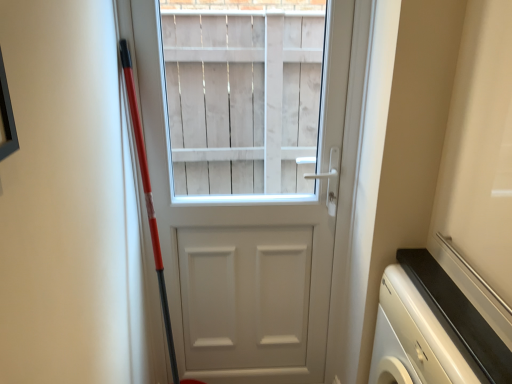
What do you see at coordinates (415, 337) in the screenshot?
I see `white glossy dishwasher at lower right` at bounding box center [415, 337].

From the picture: Measure the distance between point (381, 302) and camera.

Point (381, 302) and camera are 4.66 feet apart from each other.

You are a GUI agent. You are given a task and a screenshot of the screen. Output one action in this format:
    pyautogui.click(x=<x>, y=<y>)
    Task: Click on the white glossy dishwasher at lower right
    This screenshot has width=512, height=384.
    Given the screenshot: What is the action you would take?
    (415, 337)

Describe the element at coordinates (251, 180) in the screenshot. The height and width of the screenshot is (384, 512). I see `white matte door at center` at that location.

In order to click on white matte door at center in this screenshot , I will do `click(251, 180)`.

What is the approximate height of white matte door at center?

white matte door at center is 5.37 feet tall.

This screenshot has width=512, height=384. I want to click on white glossy dishwasher at lower right, so click(415, 337).

Consider the image. Considering the positions of objects white glossy dishwasher at lower right and white matte door at center in the image provided, who is more to the right, white glossy dishwasher at lower right or white matte door at center?

Positioned to the right is white glossy dishwasher at lower right.

Considering the positions of objects white glossy dishwasher at lower right and white matte door at center in the image provided, who is in front, white glossy dishwasher at lower right or white matte door at center?

white glossy dishwasher at lower right.

Considering the positions of points (399, 336) and (310, 173), is point (399, 336) farther from camera compared to point (310, 173)?

No, (399, 336) is in front of (310, 173).

From the image's perspective, is white glossy dishwasher at lower right above or below white matte door at center?

Clearly, from the image's perspective, white glossy dishwasher at lower right is below white matte door at center.

From a real-world perspective, between white glossy dishwasher at lower right and white matte door at center, who is vertically lower?

In real-world perspective, white glossy dishwasher at lower right is lower.

Which of these two, white glossy dishwasher at lower right or white matte door at center, is wider?

white glossy dishwasher at lower right.

Based on the photo, can you confirm if white glossy dishwasher at lower right is taller than white matte door at center?

No, white glossy dishwasher at lower right is not taller than white matte door at center.

From the picture: Is white glossy dishwasher at lower right smaller than white matte door at center?

No, white glossy dishwasher at lower right is not smaller than white matte door at center.

Looking at this image, does white glossy dishwasher at lower right contain white matte door at center?

No.

Would you consider white glossy dishwasher at lower right to be distant from white matte door at center?

They are positioned close to each other.

Is white glossy dishwasher at lower right positioned with its back to white matte door at center?

No, white glossy dishwasher at lower right is not facing the opposite direction of white matte door at center.

In the image, there is a white matte door at center. Find the location of `dish washer below it (from the image's perspective)`. dish washer below it (from the image's perspective) is located at coordinates (415, 337).

Does white matte door at center appear on the left side of white glossy dishwasher at lower right?

Yes.

Who is more distant, white matte door at center or white glossy dishwasher at lower right?

white matte door at center is further away from the camera.

Considering the positions of points (212, 168) and (413, 340), is point (212, 168) farther from camera compared to point (413, 340)?

That is True.

From the image's perspective, is white matte door at center positioned above or below white glossy dishwasher at lower right?

white matte door at center is situated higher than white glossy dishwasher at lower right in the image.

From a real-world perspective, is white matte door at center physically located above or below white glossy dishwasher at lower right?

From a real-world perspective, white matte door at center is physically above white glossy dishwasher at lower right.

In terms of width, does white matte door at center look wider or thinner when compared to white glossy dishwasher at lower right?

white matte door at center is thinner than white glossy dishwasher at lower right.

Who is shorter, white matte door at center or white glossy dishwasher at lower right?

white glossy dishwasher at lower right is shorter.

Who is bigger, white matte door at center or white glossy dishwasher at lower right?

white glossy dishwasher at lower right is bigger.

Is white glossy dishwasher at lower right located within white matte door at center?

Actually, white glossy dishwasher at lower right is outside white matte door at center.

Is white matte door at center not close to white glossy dishwasher at lower right?

That's not correct — white matte door at center is a little close to white glossy dishwasher at lower right.

Is white matte door at center looking in the opposite direction of white glossy dishwasher at lower right?

No, white glossy dishwasher at lower right is not at the back of white matte door at center.

How different are the orientations of white matte door at center and white glossy dishwasher at lower right in degrees?

90.3 degrees.

This screenshot has height=384, width=512. In order to click on dish washer directly beneath the white matte door at center (from a real-world perspective) in this screenshot , I will do `click(415, 337)`.

Find the location of `dish washer below the white matte door at center (from the image's perspective)`. dish washer below the white matte door at center (from the image's perspective) is located at coordinates (415, 337).

Identify the location of door above the white glossy dishwasher at lower right (from the image's perspective). point(251,180).